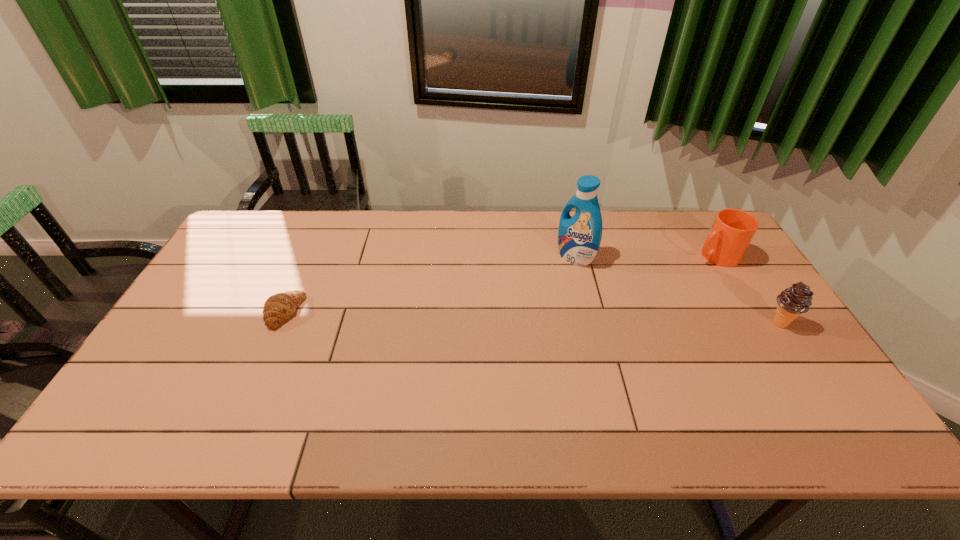
This screenshot has width=960, height=540. In order to click on the shortest object in this screenshot , I will do `click(279, 307)`.

Find the location of `crescent roll`. crescent roll is located at coordinates (279, 307).

At what (x,y) coordinates should I click in order to perform the action: click on icecream. Please return your answer as a coordinate pair (x, y). Looking at the image, I should click on (792, 302).

The image size is (960, 540). In order to click on the second object from left to right in this screenshot , I will do `click(579, 237)`.

Where is `detergent`? detergent is located at coordinates [x=579, y=237].

Where is `mug`? The image size is (960, 540). mug is located at coordinates (732, 231).

Where is `free location located on the front of the crescent roll`? The image size is (960, 540). free location located on the front of the crescent roll is located at coordinates (244, 404).

You are a GUI agent. You are given a task and a screenshot of the screen. Output one action in this format:
    pyautogui.click(x=<x>, y=<y>)
    Task: Click on the vacant space located on the left of the icecream
    Image resolution: width=960 pixels, height=540 pixels.
    Given the screenshot: What is the action you would take?
    pyautogui.click(x=685, y=323)

Locate an element on the screen. Image resolution: width=960 pixels, height=540 pixels. free space located 0.260m on the front-facing side of the tallest object is located at coordinates (506, 307).

The height and width of the screenshot is (540, 960). Identify the location of free space located 0.340m on the front-facing side of the tallest object. (487, 322).